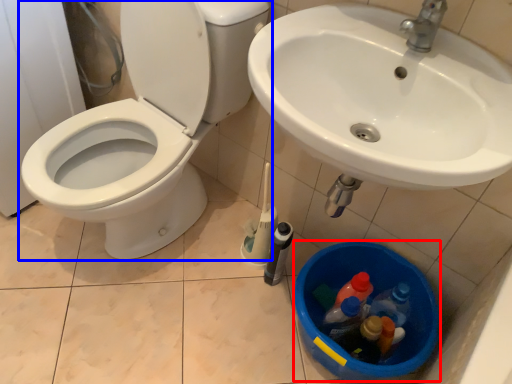
Question: Which point is further to the camera, potty (highlighted by a red box) or toilet (highlighted by a blue box)?

Choices:
 (A) potty
 (B) toilet

Answer: (A)